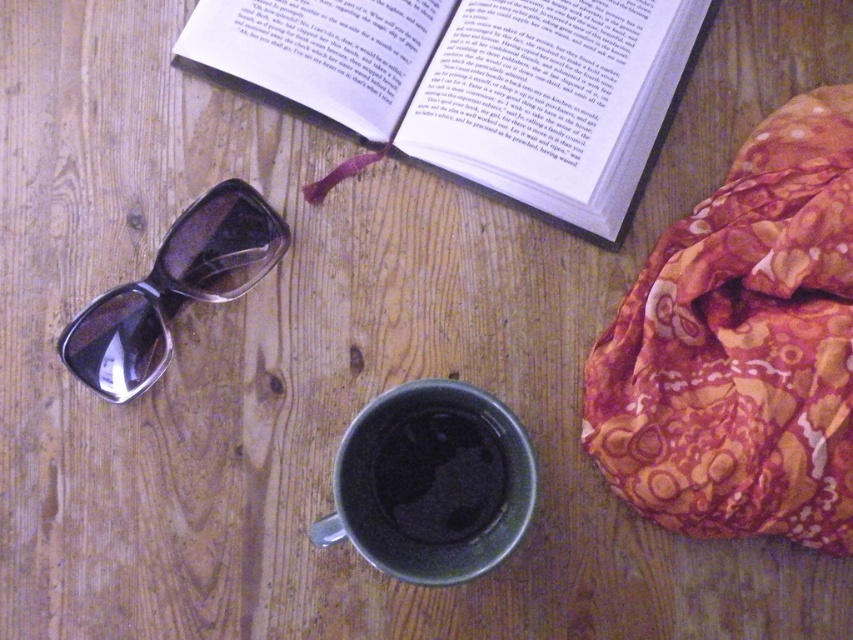
What do you see at coordinates (474, 83) in the screenshot? This screenshot has height=640, width=853. I see `hardcover book at upper center` at bounding box center [474, 83].

Identify the location of hardcover book at upper center. This screenshot has width=853, height=640. click(474, 83).

At what (x,y) coordinates should I click in order to perform the action: click on hardcover book at upper center. Please return your answer as a coordinate pair (x, y). Looking at the image, I should click on (474, 83).

Is point (822, 433) farther from camera compared to point (453, 140)?

No, it is in front of (453, 140).

Is floral silk scarf at upper right further to camera compared to hardcover book at upper center?

No, it is in front of hardcover book at upper center.

This screenshot has width=853, height=640. Describe the element at coordinates (741, 346) in the screenshot. I see `floral silk scarf at upper right` at that location.

The image size is (853, 640). Identify the location of floral silk scarf at upper right. (741, 346).

Based on the photo, which is above, matte ceramic mug at center or black matte mug at center?

Positioned higher is black matte mug at center.

Does point (369, 432) come in front of point (432, 470)?

Yes, point (369, 432) is closer to viewer.

This screenshot has height=640, width=853. Identify the location of matte ceramic mug at center. (431, 483).